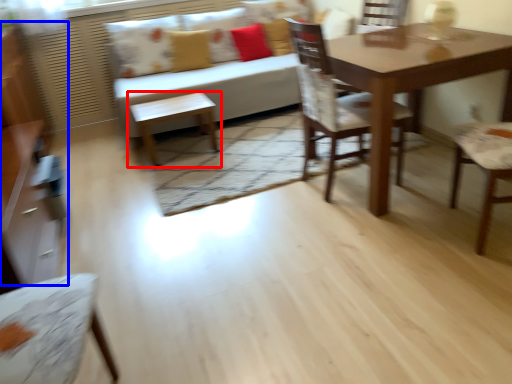
Question: Among these objects, which one is farthest to the camera, table (highlighted by a red box) or dresser (highlighted by a blue box)?

Choices:
 (A) table
 (B) dresser

Answer: (A)